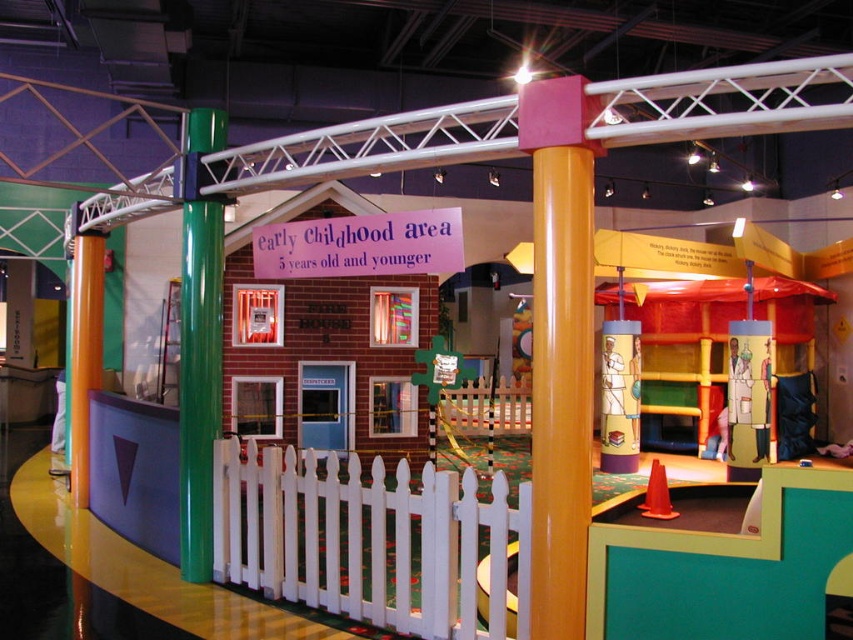
Between green glossy pillar at left and orange matte column at left, which one is positioned lower?

orange matte column at left is lower down.

Between green glossy pillar at left and orange matte column at left, which one has more height?

orange matte column at left is taller.

At what (x,y) coordinates should I click in order to perform the action: click on green glossy pillar at left. Please return your answer as a coordinate pair (x, y). Looking at the image, I should click on (199, 380).

Does orange matte column at left have a greater width compared to rubber cone at center?

Yes.

Does orange matte column at left appear on the left side of rubber cone at center?

Yes, orange matte column at left is to the left of rubber cone at center.

Who is more distant from viewer, (84, 444) or (653, 493)?

The point (84, 444) is behind.

Where is `orange matte column at left`? The width and height of the screenshot is (853, 640). orange matte column at left is located at coordinates (84, 353).

Does orange glossy column at center come behind rubber cone at center?

No, orange glossy column at center is closer to the viewer.

Does orange glossy column at center have a lesser height compared to rubber cone at center?

No, orange glossy column at center is not shorter than rubber cone at center.

Where is `orange glossy column at center`? orange glossy column at center is located at coordinates (560, 346).

This screenshot has width=853, height=640. Find the location of `orange glossy column at center`. orange glossy column at center is located at coordinates (560, 346).